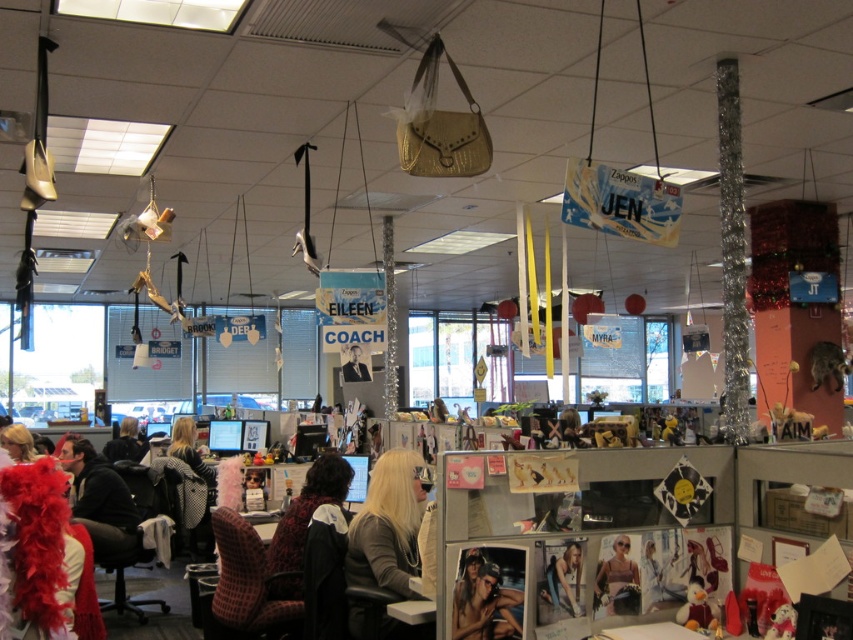
Consider the image. You are standing in the office and want to place a new decoration exactly at the same position as the dark brown leather jacket at center. What coordinates should you use?

You should use the coordinates point [303,524] to place the new decoration exactly where the dark brown leather jacket at center is located.

You are an office worker who wants to hang a new item between the matte purple dress at center and the smooth brown leather jacket at center. Can you determine which object is closer to the ceiling to ensure proper placement?

The matte purple dress at center is in front of the smooth brown leather jacket at center, so the smooth brown leather jacket at center is closer to the ceiling, allowing you to place the new item accordingly.

Based on the photo, where is the matte purple dress at center located in the image?

The matte purple dress at center is located at point (x=618, y=580) in the image.